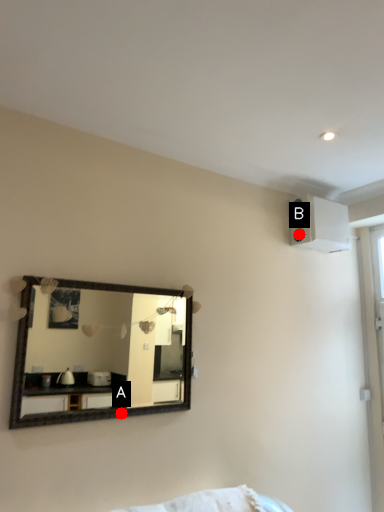
Question: Two points are circled on the image, labeled by A and B beside each circle. Which point is closer to the camera?

Choices:
 (A) A is closer
 (B) B is closer

Answer: (A)